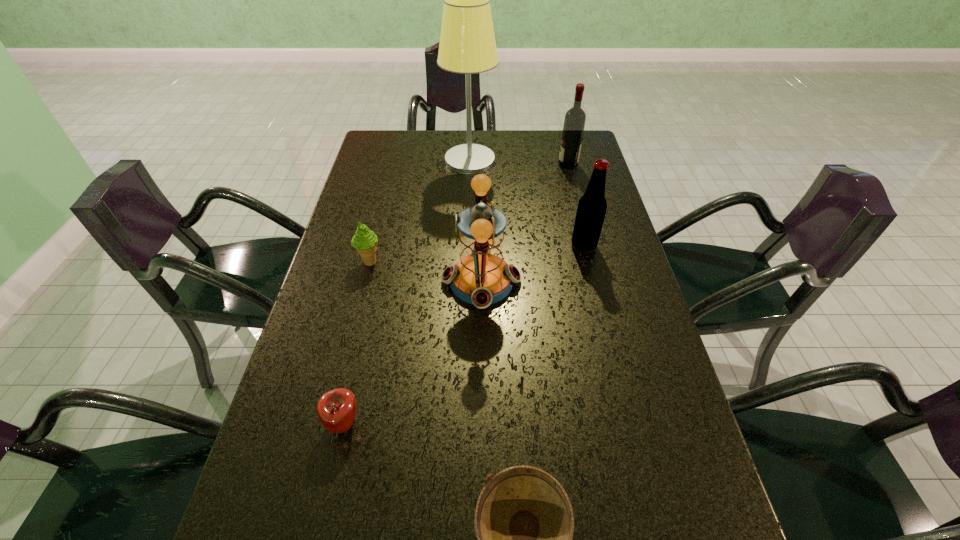
You are a GUI agent. You are given a task and a screenshot of the screen. Output one action in this format:
    pyautogui.click(x=<x>, y=<y>)
    Task: Click on the tallest object
    The width and height of the screenshot is (960, 540).
    Given the screenshot: What is the action you would take?
    pyautogui.click(x=467, y=45)

You are a GUI agent. You are given a task and a screenshot of the screen. Output one action in this format:
    pyautogui.click(x=<x>, y=<y>)
    Task: Click on the alcohol
    
    Given the screenshot: What is the action you would take?
    pyautogui.click(x=575, y=118)

The width and height of the screenshot is (960, 540). In order to click on beer bottle in this screenshot , I will do `click(592, 206)`.

I want to click on lantern, so click(x=481, y=277).

Image resolution: width=960 pixels, height=540 pixels. I want to click on icecream, so click(365, 241).

The image size is (960, 540). I want to click on apple, so click(x=336, y=409).

This screenshot has width=960, height=540. Identify the location of the sixth farthest object. (336, 409).

Where is `free spot located 0.160m on the left of the tallest object`? This screenshot has height=540, width=960. free spot located 0.160m on the left of the tallest object is located at coordinates (398, 160).

You are a GUI agent. You are given a task and a screenshot of the screen. Output one action in this format:
    pyautogui.click(x=<x>, y=<y>)
    Task: Click on the free region located on the front and back of the alcohol
    
    Given the screenshot: What is the action you would take?
    pyautogui.click(x=475, y=164)

Where is `vacant region located 0.400m on the front and back of the alcohol`? The image size is (960, 540). vacant region located 0.400m on the front and back of the alcohol is located at coordinates coord(444,164).